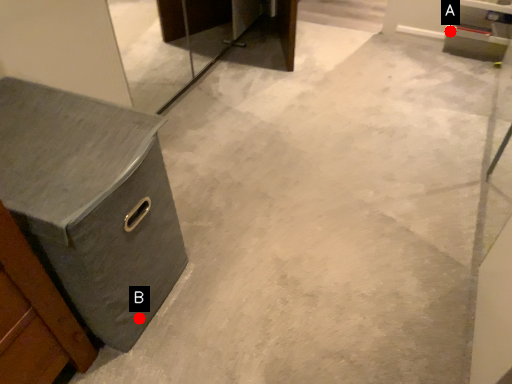
Question: Two points are circled on the image, labeled by A and B beside each circle. Among these points, which one is nearest to the camera?

Choices:
 (A) A is closer
 (B) B is closer

Answer: (B)